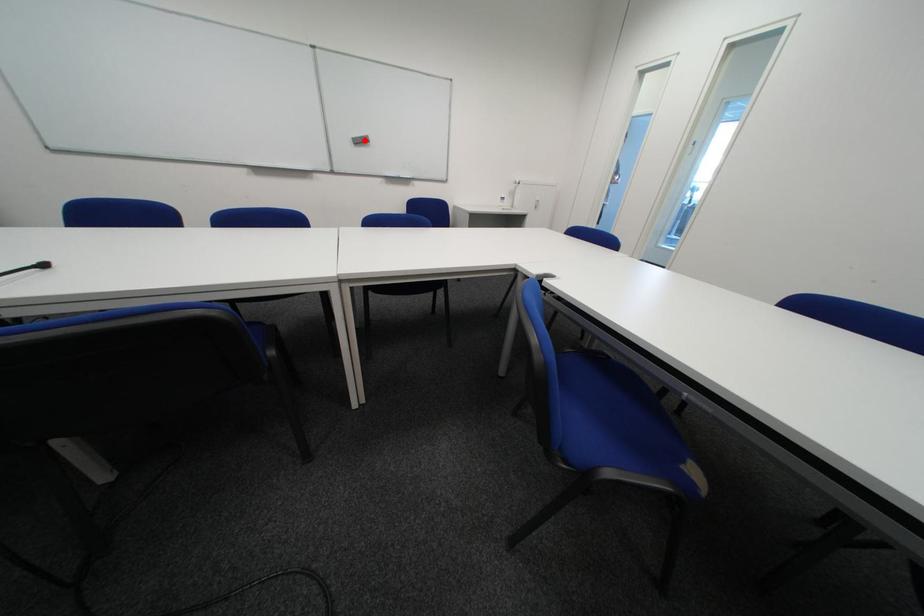
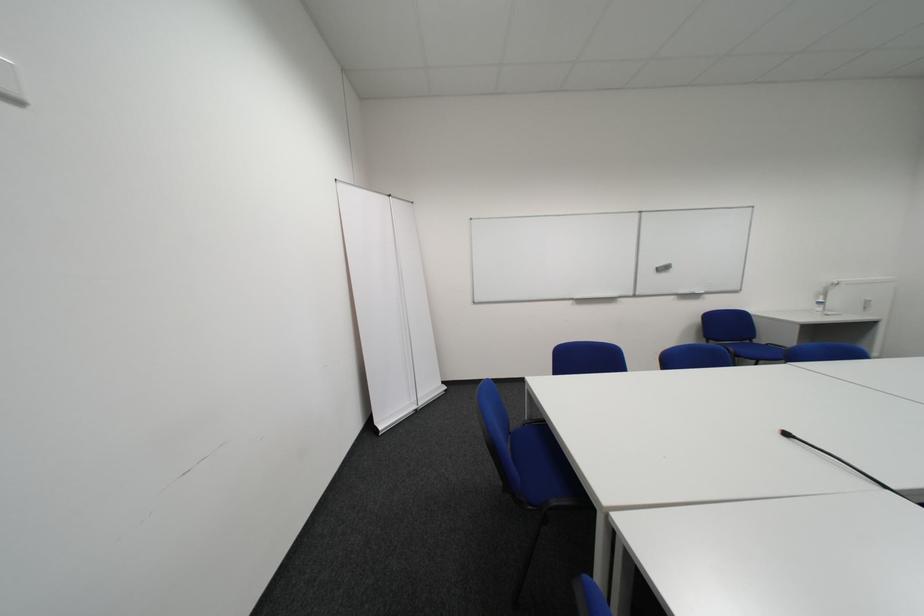
Find the pixel in the second image that matches the highlighted location in the first image.

(669, 270)